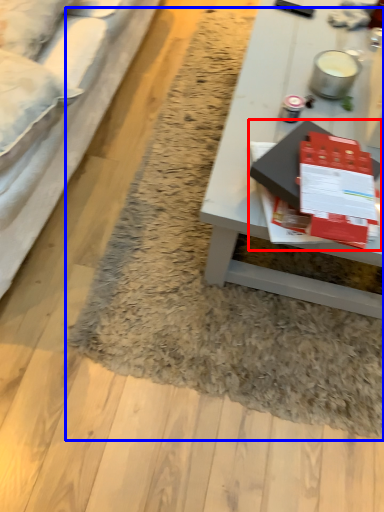
Question: Which of the following is the farthest to the observer, magazine (highlighted by a red box) or mat (highlighted by a blue box)?

Choices:
 (A) magazine
 (B) mat

Answer: (B)